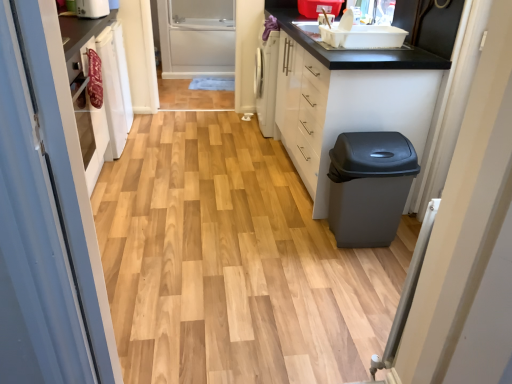
Locate an element on the screen. vacant space to the left of white glossy cabinet at right is located at coordinates [x=222, y=170].